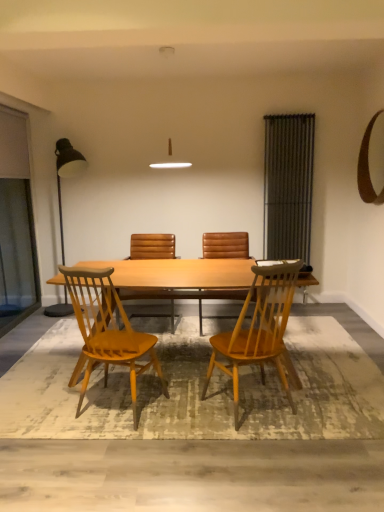
Question: Is there a large distance between light brown wood chair at center, the first chair from the front, and metallic gray radiator at right, which ranks as the second screen door in left-to-right order?

Choices:
 (A) yes
 (B) no

Answer: (A)

Question: Considering the relative sizes of light brown wood chair at center, the first chair from the front, and metallic gray radiator at right, which ranks as the second screen door in left-to-right order, in the image provided, is light brown wood chair at center, the first chair from the front, shorter than metallic gray radiator at right, which ranks as the second screen door in left-to-right order,?

Choices:
 (A) no
 (B) yes

Answer: (B)

Question: Does light brown wood chair at center, which is counted as the 4th chair, starting from the back, come in front of metallic gray radiator at right, which ranks as the second screen door in left-to-right order?

Choices:
 (A) no
 (B) yes

Answer: (B)

Question: From a real-world perspective, is light brown wood chair at center, which is counted as the 4th chair, starting from the back, under metallic gray radiator at right, which ranks as the second screen door in left-to-right order?

Choices:
 (A) yes
 (B) no

Answer: (A)

Question: From a real-world perspective, is light brown wood chair at center, which is counted as the 4th chair, starting from the back, over metallic gray radiator at right, which ranks as the second screen door in left-to-right order?

Choices:
 (A) yes
 (B) no

Answer: (B)

Question: Does light brown wood chair at center, which is counted as the 4th chair, starting from the back, have a smaller size compared to metallic gray radiator at right, the first screen door when ordered from right to left?

Choices:
 (A) no
 (B) yes

Answer: (A)

Question: Considering the relative sizes of textured beige rug at lower center and light brown wood table at center in the image provided, is textured beige rug at lower center smaller than light brown wood table at center?

Choices:
 (A) no
 (B) yes

Answer: (B)

Question: From a real-world perspective, is textured beige rug at lower center under light brown wood table at center?

Choices:
 (A) no
 (B) yes

Answer: (B)

Question: From the image's perspective, is textured beige rug at lower center on top of light brown wood table at center?

Choices:
 (A) no
 (B) yes

Answer: (A)

Question: Can you confirm if textured beige rug at lower center is thinner than light brown wood table at center?

Choices:
 (A) yes
 (B) no

Answer: (B)

Question: Is light brown wood table at center at the back of textured beige rug at lower center?

Choices:
 (A) yes
 (B) no

Answer: (B)

Question: Is textured beige rug at lower center further to camera compared to light brown wood table at center?

Choices:
 (A) no
 (B) yes

Answer: (A)

Question: From the image's perspective, is metallic black floor lamp at left above metallic gray radiator at right, the first screen door when ordered from right to left?

Choices:
 (A) no
 (B) yes

Answer: (A)